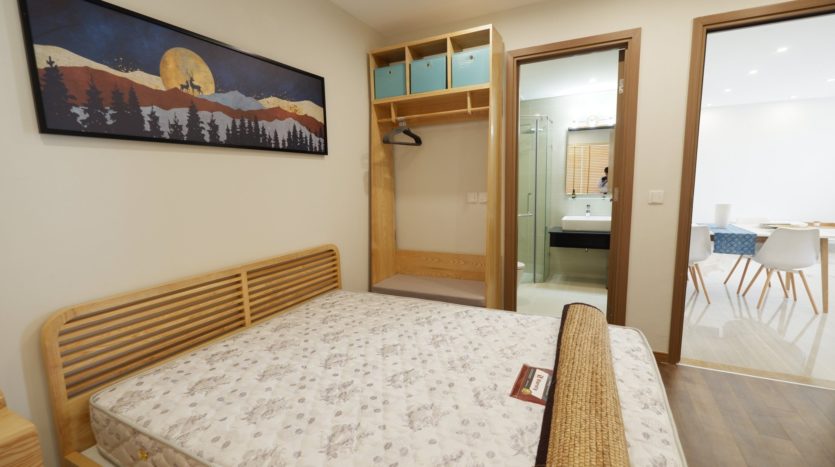
In order to click on glaring light reflections in this screenshot , I will do `click(782, 117)`, `click(706, 118)`, `click(601, 89)`, `click(582, 104)`.